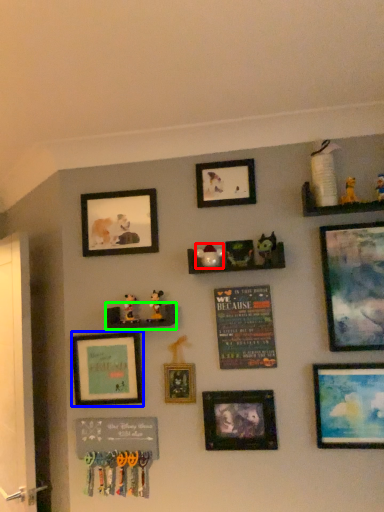
Question: Based on their relative distances, which object is farther from toy (highlighted by a red box)? Choose from picture frame (highlighted by a blue box) and shelf (highlighted by a green box).

Choices:
 (A) picture frame
 (B) shelf

Answer: (A)